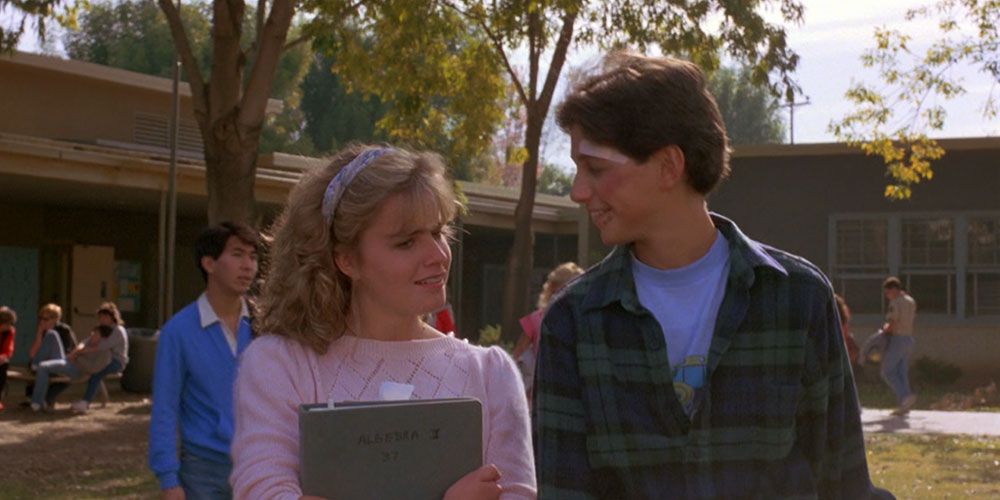
Find the location of a particular element. Image resolution: width=1000 pixels, height=500 pixels. entry door ajar is located at coordinates (93, 272).